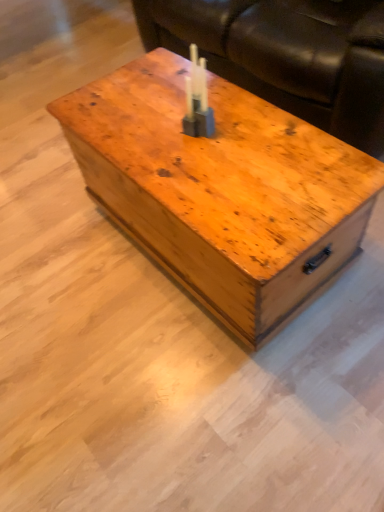
Image resolution: width=384 pixels, height=512 pixels. I want to click on free space on the front side of wooden chest at center, so click(x=213, y=398).